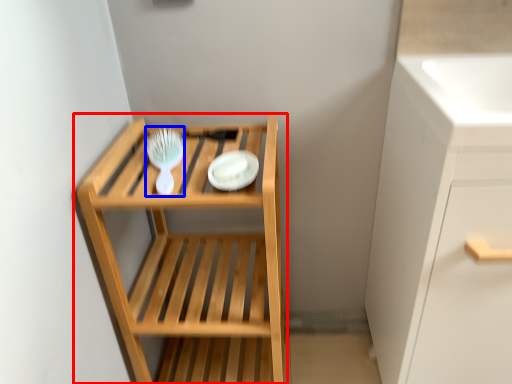
Question: Which of the following is the closest to the observer, shelf (highlighted by a red box) or brush (highlighted by a blue box)?

Choices:
 (A) shelf
 (B) brush

Answer: (A)